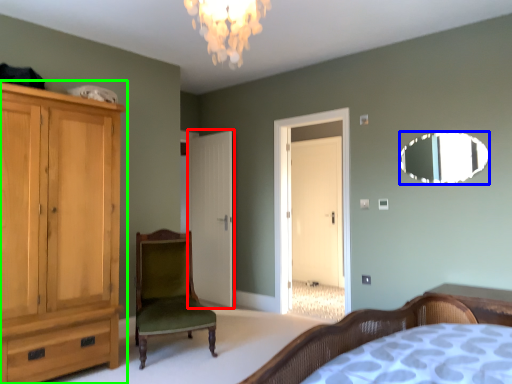
Question: Which object is the farthest from door (highlighted by a red box)? Choose among these: mirror (highlighted by a blue box) or cabinetry (highlighted by a green box).

Choices:
 (A) mirror
 (B) cabinetry

Answer: (A)